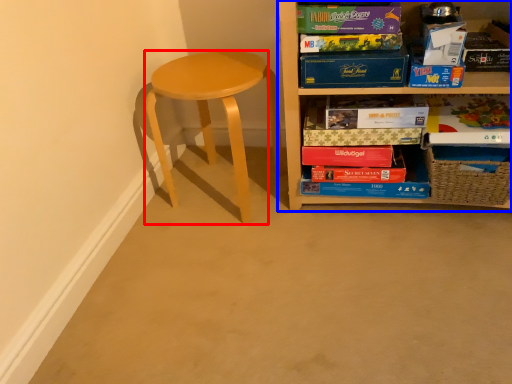
Question: Which object appears closest to the camera in this image, stool (highlighted by a red box) or shelf (highlighted by a blue box)?

Choices:
 (A) stool
 (B) shelf

Answer: (B)